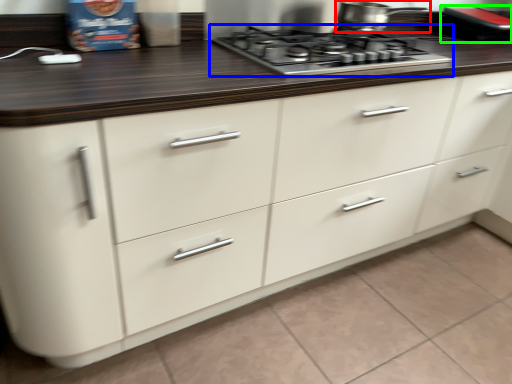
Question: Estimate the real-world distances between objects in this image. Which object is closer to kitchen appliance (highlighted by a red box), gas stove (highlighted by a blue box) or appliance (highlighted by a green box)?

Choices:
 (A) gas stove
 (B) appliance

Answer: (A)